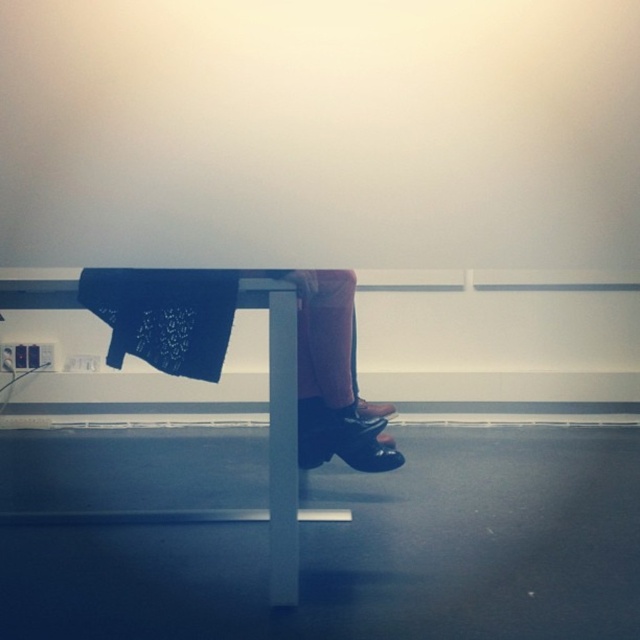
Question: Is white glossy table at center wider than blue textured fabric at center?

Choices:
 (A) no
 (B) yes

Answer: (B)

Question: Does white glossy table at center have a lesser width compared to blue textured fabric at center?

Choices:
 (A) yes
 (B) no

Answer: (B)

Question: Which object appears farthest from the camera in this image?

Choices:
 (A) blue textured fabric at center
 (B) white glossy table at center

Answer: (B)

Question: Which point is closer to the camera?

Choices:
 (A) (86, 288)
 (B) (268, 296)

Answer: (B)

Question: Is white glossy table at center thinner than blue textured fabric at center?

Choices:
 (A) no
 (B) yes

Answer: (A)

Question: Which point is farther from the camera taking this photo?

Choices:
 (A) (282, 401)
 (B) (221, 358)

Answer: (B)